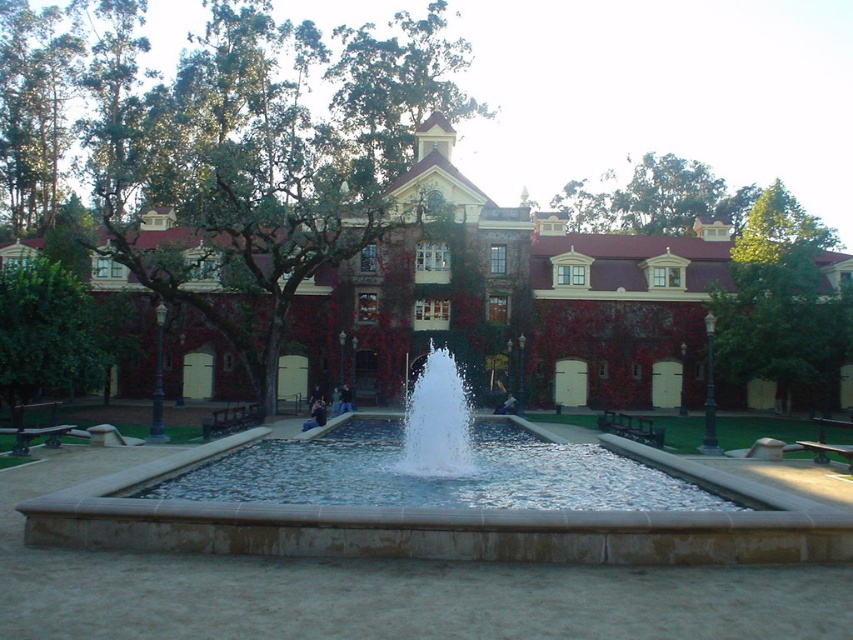
Looking at this image, you are standing in the courtyard looking at the fountain and the building. There are two points marked in the image. The first point is at coordinates point (339, 36) and the second is at point (570, 188). Which point is closer to you?

Point (339, 36) is closer to you because it is further to the camera than point (570, 188).

You are standing in the courtyard looking towards the fountain. Which object, the green leafy tree at upper right or the white water at center, would appear larger in your field of view?

The green leafy tree at upper right appears larger in your field of view because it is bigger than the white water at center according to the description.